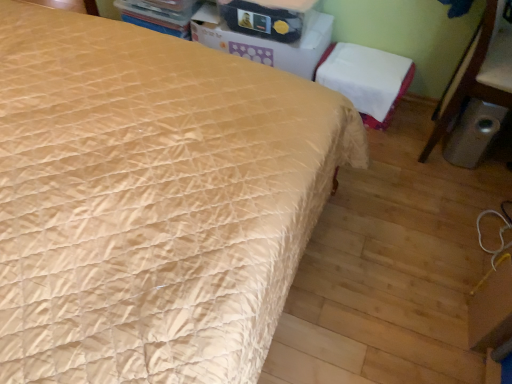
Question: Is white fabric chair at upper right at the left side of matte cardboard box at upper center?

Choices:
 (A) no
 (B) yes

Answer: (A)

Question: Does white fabric chair at upper right lie behind matte cardboard box at upper center?

Choices:
 (A) yes
 (B) no

Answer: (A)

Question: From the image's perspective, does white fabric chair at upper right appear higher than matte cardboard box at upper center?

Choices:
 (A) no
 (B) yes

Answer: (A)

Question: Is white fabric chair at upper right positioned with its back to matte cardboard box at upper center?

Choices:
 (A) yes
 (B) no

Answer: (B)

Question: Does white fabric chair at upper right turn towards matte cardboard box at upper center?

Choices:
 (A) no
 (B) yes

Answer: (A)

Question: Could matte cardboard box at upper center be considered to be inside white fabric chair at upper right?

Choices:
 (A) no
 (B) yes

Answer: (A)

Question: Considering the relative sizes of white cardboard box at upper center and white fabric chair at upper right in the image provided, is white cardboard box at upper center smaller than white fabric chair at upper right?

Choices:
 (A) yes
 (B) no

Answer: (B)

Question: Is white cardboard box at upper center positioned in front of white fabric chair at upper right?

Choices:
 (A) yes
 (B) no

Answer: (A)

Question: Is white cardboard box at upper center turned away from white fabric chair at upper right?

Choices:
 (A) yes
 (B) no

Answer: (B)

Question: Is white fabric chair at upper right completely or partially inside white cardboard box at upper center?

Choices:
 (A) no
 (B) yes

Answer: (A)

Question: Is white cardboard box at upper center next to white fabric chair at upper right and touching it?

Choices:
 (A) no
 (B) yes

Answer: (A)

Question: Considering the relative sizes of white cardboard box at upper center and white fabric chair at upper right in the image provided, is white cardboard box at upper center bigger than white fabric chair at upper right?

Choices:
 (A) no
 (B) yes

Answer: (B)

Question: From the image's perspective, is white cardboard box at upper center on top of metallic trash can at lower right?

Choices:
 (A) yes
 (B) no

Answer: (A)